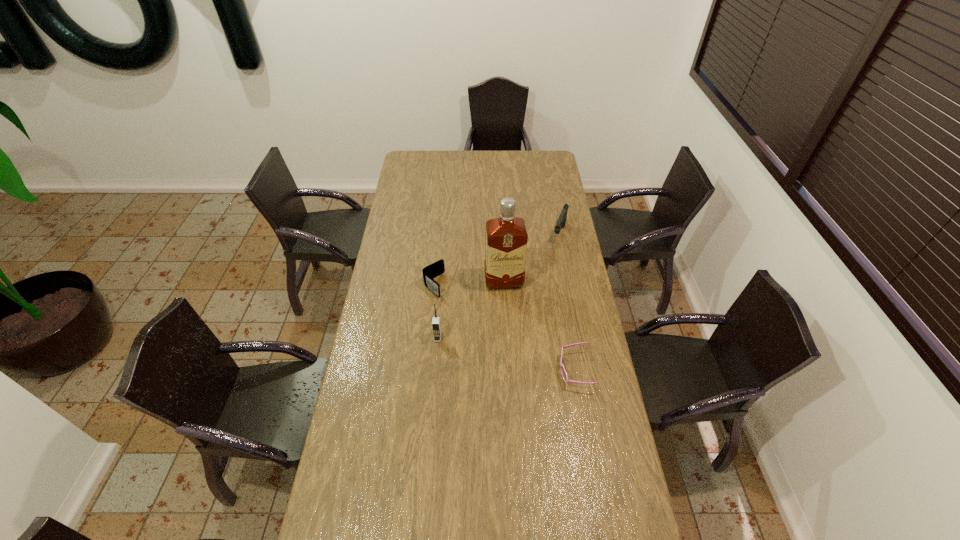
What are the coordinates of `free space between the shortest object and the liquor` in the screenshot? It's located at (540, 326).

Identify the location of vacant area that lies between the nearest object and the fourth tallest object. (504, 328).

Where is `blank region between the fourth tallest object and the third object from left to right`? Image resolution: width=960 pixels, height=540 pixels. blank region between the fourth tallest object and the third object from left to right is located at coordinates (468, 284).

The image size is (960, 540). Find the location of `empty space that is in between the tallest object and the third shortest object`. empty space that is in between the tallest object and the third shortest object is located at coordinates (532, 258).

Find the location of `vacant area between the sunglasses and the tallest object`. vacant area between the sunglasses and the tallest object is located at coordinates (540, 326).

Image resolution: width=960 pixels, height=540 pixels. Identify the location of empty location between the pistol and the nearest object. (567, 302).

Locate an element on the screen. The width and height of the screenshot is (960, 540). free space between the cellular telephone and the sunglasses is located at coordinates (506, 354).

Select which object appears as the second closest to the second shortest object. Please provide its 2D coordinates. Your answer should be formatted as a tuple, i.e. [(x, y)], where the tuple contains the x and y coordinates of a point satisfying the conditions above.

[(436, 326)]

Identify the location of object that is the second closest to the third object from right to left. The image size is (960, 540). (561, 221).

Identify the location of vacant space that satisfies the following two spatial constraints: 1. on the front-facing side of the shortest object; 2. on the front-facing side of the second nearest object. The height and width of the screenshot is (540, 960). (435, 370).